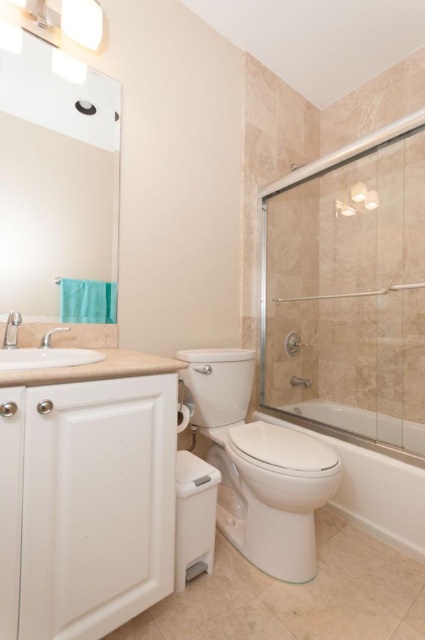
Question: Is white glossy toilet at center wider than white porcelain sink at left?

Choices:
 (A) yes
 (B) no

Answer: (A)

Question: Is clear glass shower door at right wider than white porcelain sink at left?

Choices:
 (A) yes
 (B) no

Answer: (A)

Question: Does clear glass shower door at right have a smaller size compared to white glossy toilet at center?

Choices:
 (A) yes
 (B) no

Answer: (B)

Question: Which object is farther from the camera taking this photo?

Choices:
 (A) white porcelain sink at left
 (B) white glossy toilet at center
 (C) white glossy bathtub at lower right

Answer: (C)

Question: Which point is closer to the camera?

Choices:
 (A) white glossy bathtub at lower right
 (B) white porcelain sink at left

Answer: (B)

Question: Estimate the real-world distances between objects in this image. Which object is closer to the white glossy bathtub at lower right?

Choices:
 (A) clear glass shower door at right
 (B) white porcelain sink at left

Answer: (A)